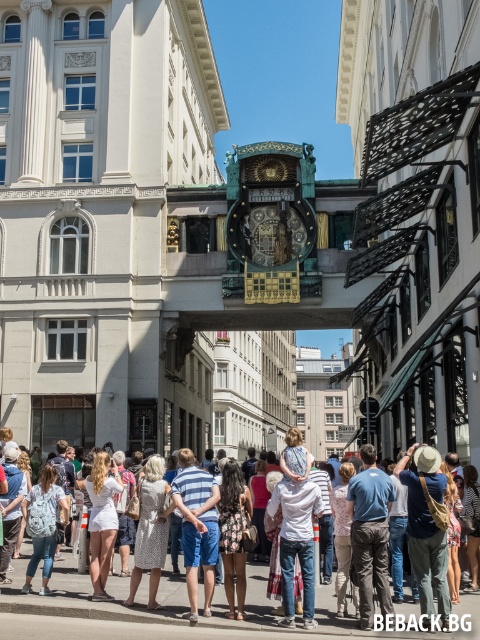
Does white cotton crowd at center have a greater height compared to white cotton shirt at center?

No.

Who is positioned more to the right, white cotton crowd at center or white cotton shirt at center?

From the viewer's perspective, white cotton shirt at center appears more on the right side.

The width and height of the screenshot is (480, 640). What do you see at coordinates (130, 609) in the screenshot? I see `white cotton crowd at center` at bounding box center [130, 609].

Locate an element on the screen. white cotton crowd at center is located at coordinates (130, 609).

This screenshot has width=480, height=640. Describe the element at coordinates (43, 524) in the screenshot. I see `denim backpack at lower left` at that location.

Can you confirm if denim backpack at lower left is smaller than white cotton shirt at center?

Yes.

Locate an element on the screen. The height and width of the screenshot is (640, 480). denim backpack at lower left is located at coordinates (43, 524).

Is point (144, 552) farther from viewer compared to point (236, 572)?

Yes.

Can you confirm if white dotted dress at center is smaller than brown printed dress at center?

No, white dotted dress at center is not smaller than brown printed dress at center.

Who is more forward, (x=144, y=524) or (x=237, y=564)?

Positioned in front is point (x=237, y=564).

Where is `white dotted dress at center`? This screenshot has width=480, height=640. white dotted dress at center is located at coordinates (151, 529).